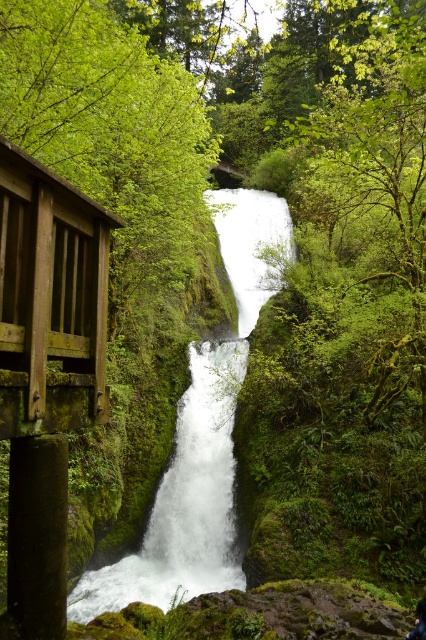
Question: Which of the following is the closest to the observer?

Choices:
 (A) dark blue fabric at lower right
 (B) white frothy water at center
 (C) white smooth waterfall at center

Answer: (A)

Question: Among these objects, which one is nearest to the camera?

Choices:
 (A) dark blue fabric at lower right
 (B) white smooth waterfall at center
 (C) white frothy water at center

Answer: (A)

Question: Does white smooth waterfall at center have a larger size compared to white frothy water at center?

Choices:
 (A) no
 (B) yes

Answer: (B)

Question: Among these objects, which one is farthest from the camera?

Choices:
 (A) white smooth waterfall at center
 (B) white frothy water at center
 (C) dark blue fabric at lower right

Answer: (B)

Question: Is the position of white smooth waterfall at center more distant than that of dark blue fabric at lower right?

Choices:
 (A) yes
 (B) no

Answer: (A)

Question: Can you confirm if white smooth waterfall at center is wider than white frothy water at center?

Choices:
 (A) yes
 (B) no

Answer: (A)